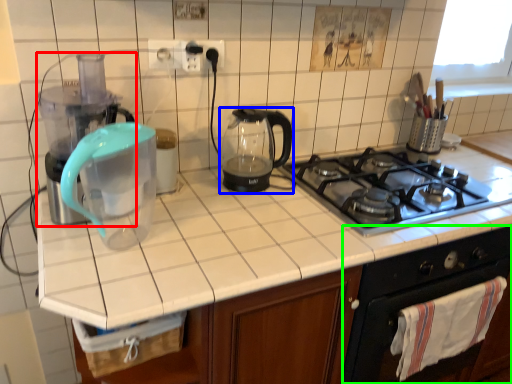
Question: Based on their relative distances, which object is nearer to blender (highlighted by a red box)? Choose from kitchen appliance (highlighted by a blue box) and oven (highlighted by a green box).

Choices:
 (A) kitchen appliance
 (B) oven

Answer: (A)